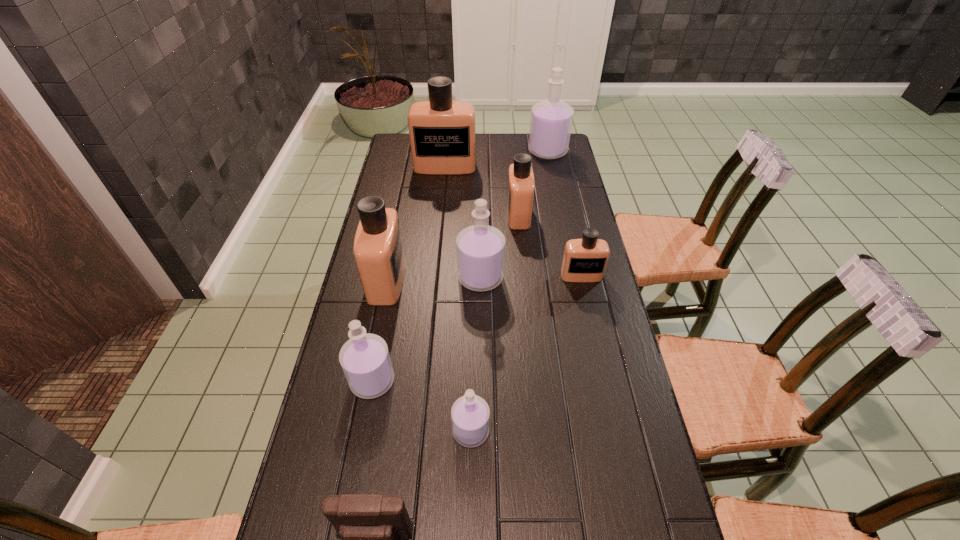
The image size is (960, 540). Find the location of `the biggest purple perfume`. the biggest purple perfume is located at coordinates (551, 121).

In order to click on the farthest purple perfume in this screenshot , I will do `click(551, 121)`.

Locate an element on the screen. This screenshot has height=540, width=960. the biggest beige perfume is located at coordinates (442, 132).

The width and height of the screenshot is (960, 540). In order to click on the third smallest beige perfume in this screenshot , I will do `click(378, 250)`.

Where is `the third nearest purple perfume`? The height and width of the screenshot is (540, 960). the third nearest purple perfume is located at coordinates (480, 248).

Locate an element on the screen. This screenshot has height=540, width=960. the sixth nearest perfume is located at coordinates (520, 192).

The width and height of the screenshot is (960, 540). What are the coordinates of `the seventh object from left to right` in the screenshot? It's located at (520, 192).

The height and width of the screenshot is (540, 960). I want to click on the leftmost purple perfume, so click(x=365, y=360).

Where is `the second nearest perfume`? Image resolution: width=960 pixels, height=540 pixels. the second nearest perfume is located at coordinates (365, 360).

Identify the location of the eighth farthest object. This screenshot has height=540, width=960. (470, 414).